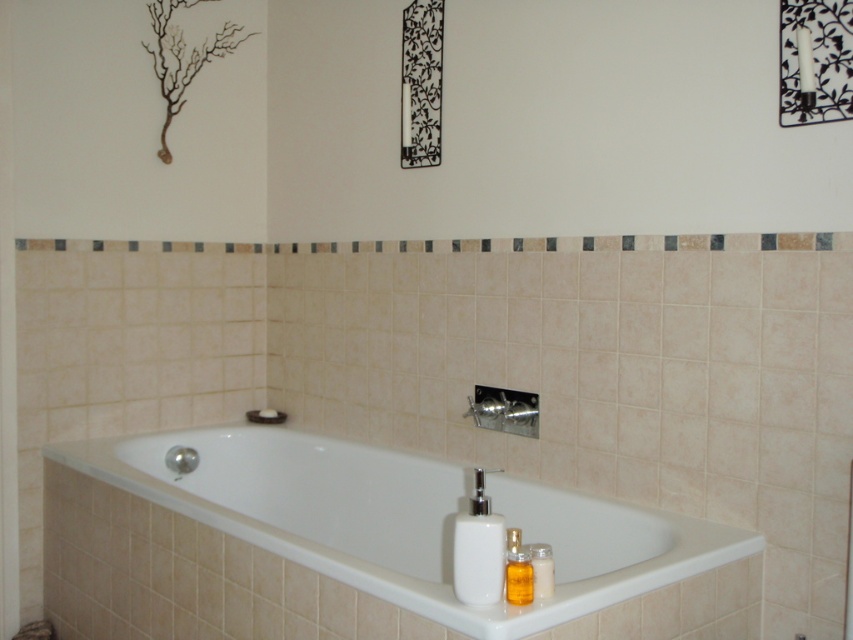
Question: Does white glossy bathtub at center appear on the left side of white glossy soap dispenser at center?

Choices:
 (A) no
 (B) yes

Answer: (B)

Question: Does white glossy bathtub at center lie in front of white glossy soap dispenser at center?

Choices:
 (A) no
 (B) yes

Answer: (B)

Question: Which of these objects is positioned farthest from the white glossy soap dispenser at center?

Choices:
 (A) brushed metal shower at lower center
 (B) white glossy bathtub at center
 (C) white matte soap at upper left
 (D) translucent plastic bottle at lower right

Answer: (C)

Question: Is white glossy bathtub at center wider than brushed metal shower at lower center?

Choices:
 (A) yes
 (B) no

Answer: (A)

Question: Among these points, which one is farthest from the camera?

Choices:
 (A) (476, 400)
 (B) (268, 417)

Answer: (B)

Question: Which point is farther to the camera?

Choices:
 (A) (491, 406)
 (B) (664, 608)
 (C) (271, 412)
 (D) (537, 582)

Answer: (C)